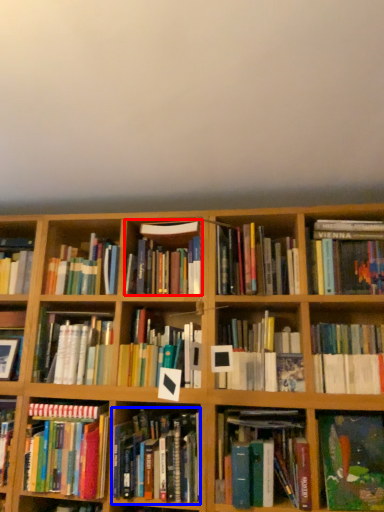
Question: Which object is further to the camera taking this photo, book (highlighted by a red box) or book (highlighted by a blue box)?

Choices:
 (A) book
 (B) book

Answer: (A)